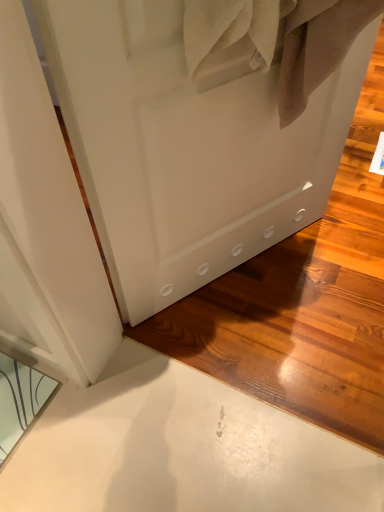
You are a GUI agent. You are given a task and a screenshot of the screen. Output one action in this format:
    pyautogui.click(x=<x>, y=<y>)
    Task: Click on the free space underneath white matte door at center (from a real-world perspective)
    Image resolution: width=384 pixels, height=512 pixels.
    Given the screenshot: What is the action you would take?
    pyautogui.click(x=237, y=276)